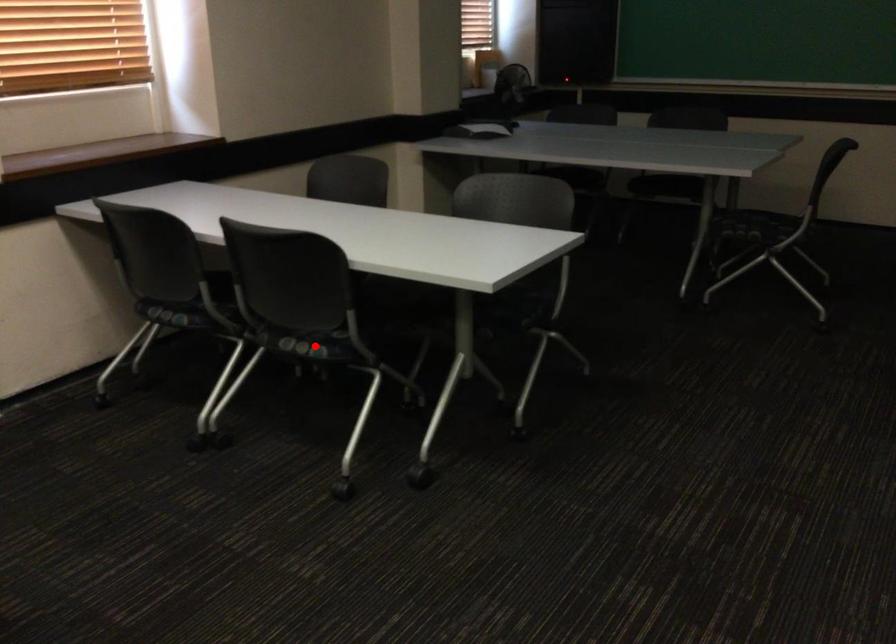
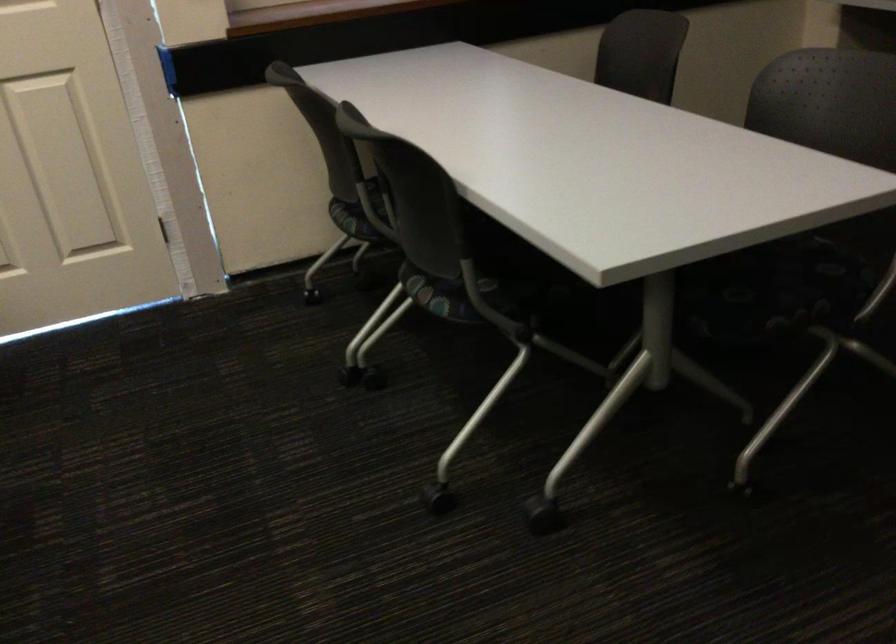
Question: A red point is marked in image1. In image2, is the corresponding 3D point closer to the camera or farther? Reply with the corresponding letter.

Choices:
 (A) The corresponding 3D point is closer.
 (B) The corresponding 3D point is farther.

Answer: (A)